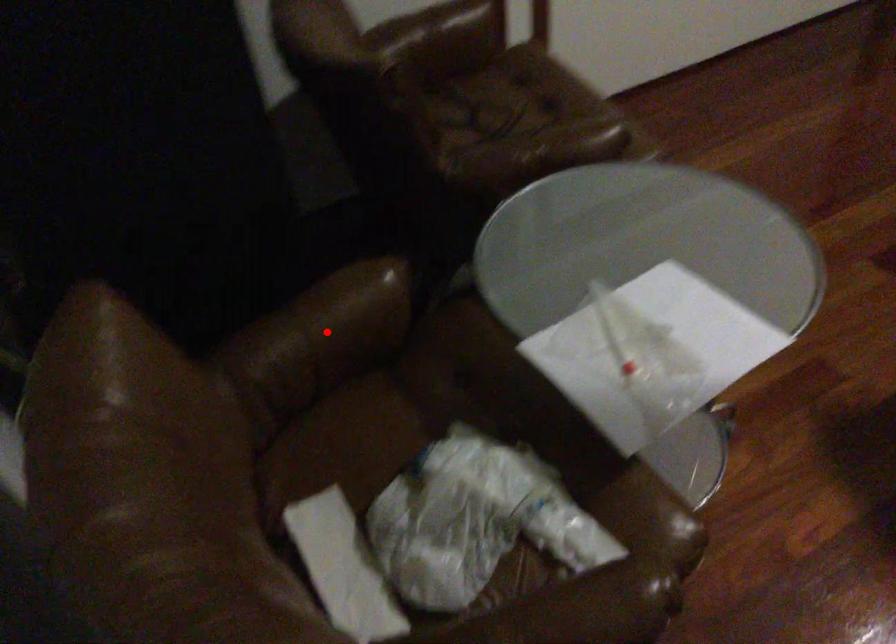
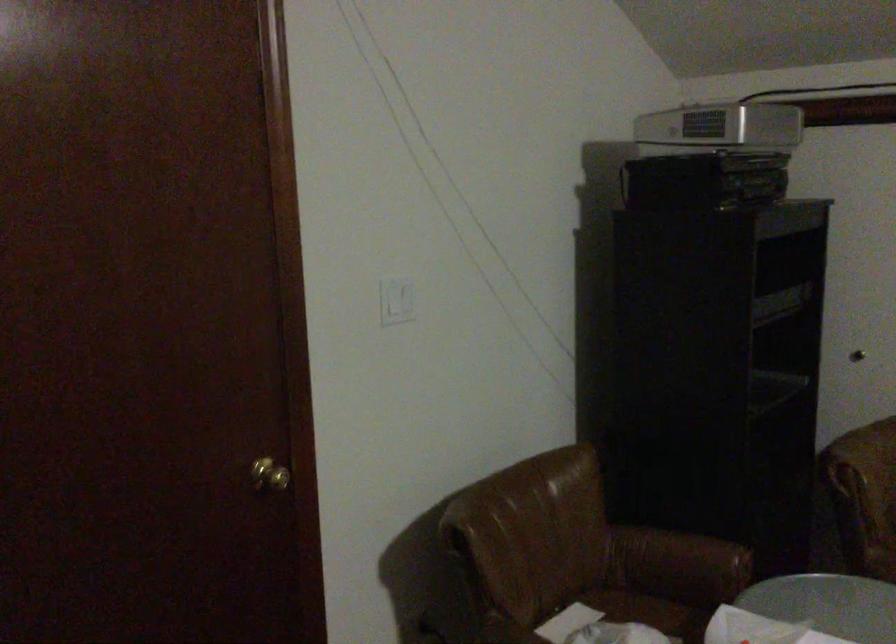
The point at the highlighted location is marked in the first image. Where is the corresponding point in the second image?

(679, 559)